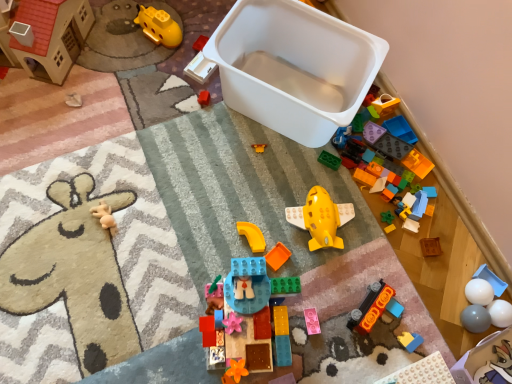
Find the location of a particular element. The height and width of the screenshot is (384, 512). empty space that is in between beige rubber bear at left, placed as the 2th toy when sorted from left to right, and translucent blue plastic building block at center, the fifth toy viewed from the left is located at coordinates (167, 273).